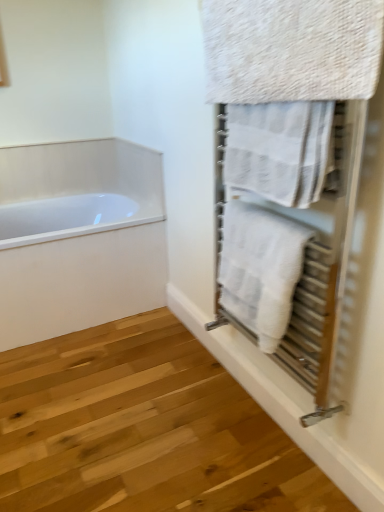
Locate an element on the screen. This screenshot has height=512, width=384. vacant region below white textured towel at right, positioned as the third towel in top-to-bottom order (from a real-world perspective) is located at coordinates (250, 428).